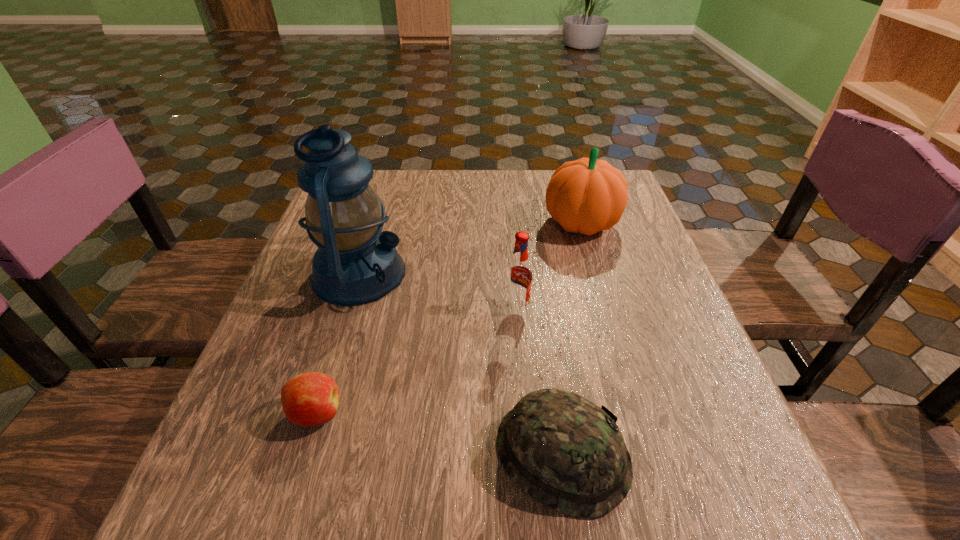
Where is `lantern`? Image resolution: width=960 pixels, height=540 pixels. lantern is located at coordinates (355, 263).

You are a GUI agent. You are given a task and a screenshot of the screen. Output one action in this format:
    pyautogui.click(x=<x>, y=<y>)
    Task: Click on the pumpkin
    The height and width of the screenshot is (540, 960).
    Given the screenshot: What is the action you would take?
    pyautogui.click(x=585, y=196)

Find the location of `root beer`. root beer is located at coordinates (518, 283).

What are the coordinates of `the fourth tallest object` in the screenshot? It's located at (566, 452).

Identify the location of apple. (310, 399).

What are the coordinates of `vacant space located 0.380m on the face of the lantern` in the screenshot? It's located at (572, 273).

Where is `free space located 0.200m on the left of the pumpkin`? This screenshot has width=960, height=540. free space located 0.200m on the left of the pumpkin is located at coordinates (466, 223).

Where is `vacant space located on the back of the root beer`? Image resolution: width=960 pixels, height=540 pixels. vacant space located on the back of the root beer is located at coordinates (515, 280).

I want to click on vacant space located on the left of the headwear, so click(x=337, y=455).

Find the location of a particular element. vacant space located 0.150m on the back of the apple is located at coordinates (343, 327).